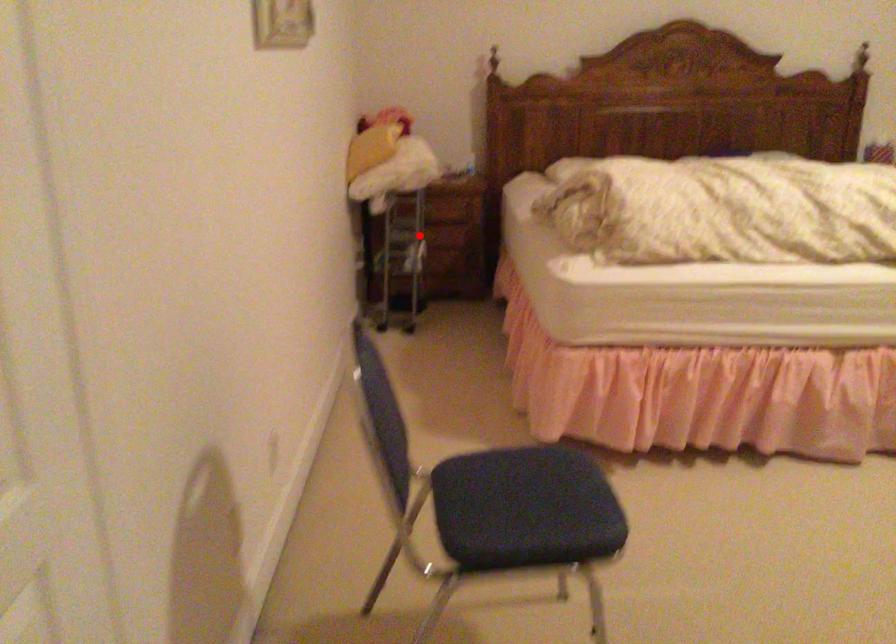
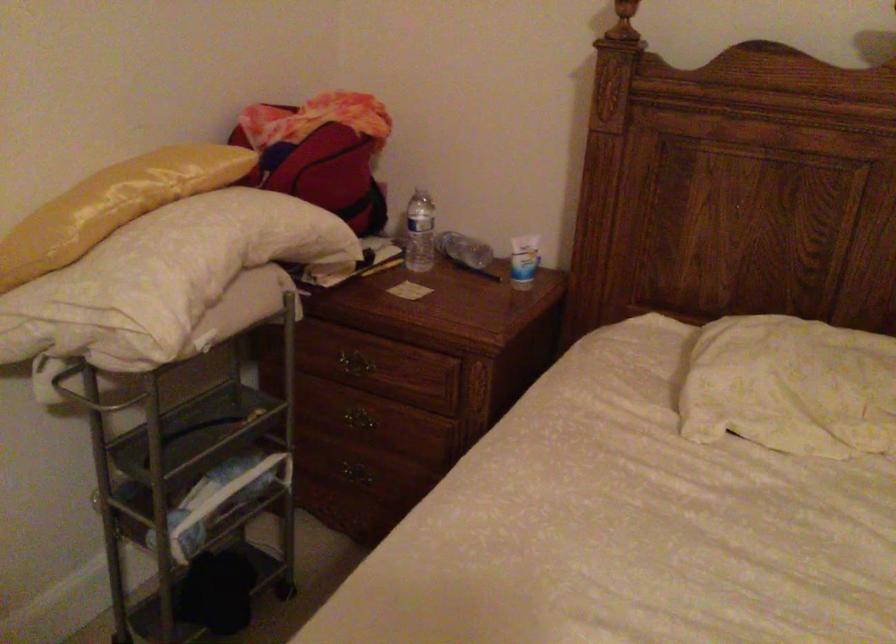
Question: I am providing you with two images of the same scene from different viewpoints. In image1, a red point is highlighted. Considering the same 3D point in image2, which of the following is correct?

Choices:
 (A) It is closer
 (B) It is farther

Answer: (A)